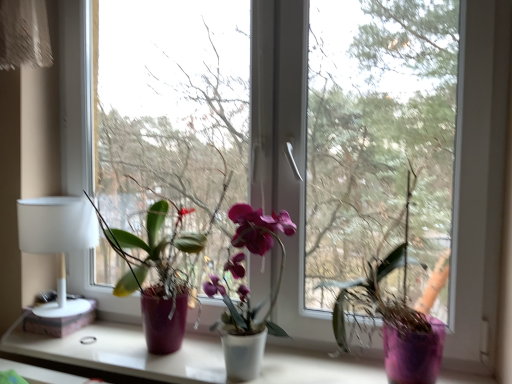
Image resolution: width=512 pixels, height=384 pixels. I want to click on vacant space underneath white matte table lamp at left (from a real-world perspective), so click(53, 339).